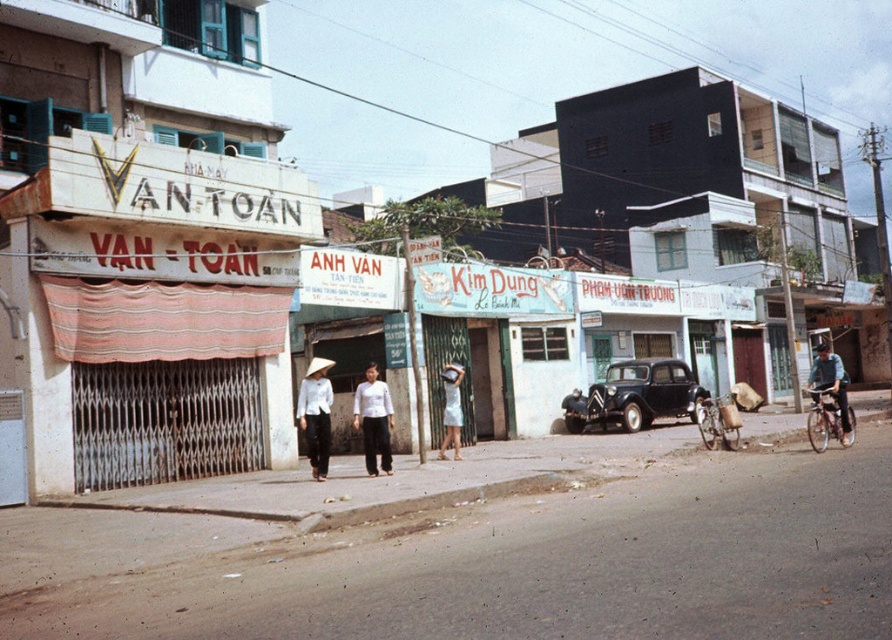
You are a fashion designer who wants to display both the light blue denim jacket at right and the white satin dress at center in a store window. Given their sizes, which item should be placed in the larger display area?

The light blue denim jacket at right is bigger than the white satin dress at center, so it should be placed in the larger display area to accommodate its size properly.

Based on the photo, you are a photographer standing in the street scene and want to capture both the white matte pants at center and the white satin dress at center in a single frame. Which of these two items should you focus on first to ensure both are in the frame?

You should focus on the white satin dress at center first because it is below the white matte pants at center, so adjusting the camera angle to include the lower area will naturally capture both items.